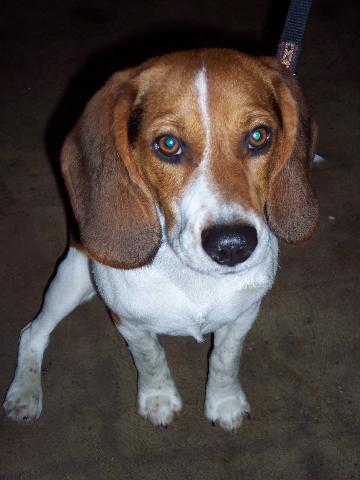
Image resolution: width=360 pixels, height=480 pixels. What are the coordinates of `grey in carpet` in the screenshot? It's located at (104, 396), (112, 445), (201, 456).